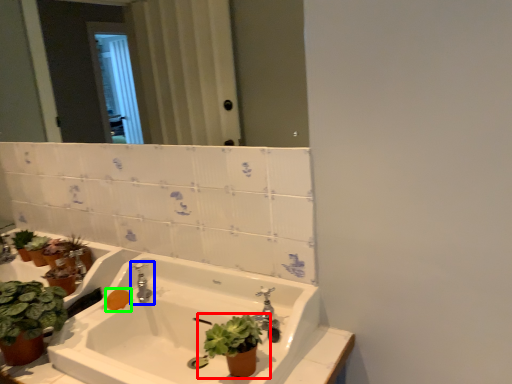
Question: Which object is positioned closest to houseplant (highlighted by a red box)? Select from tap (highlighted by a blue box) and soap (highlighted by a green box).

Choices:
 (A) tap
 (B) soap

Answer: (A)